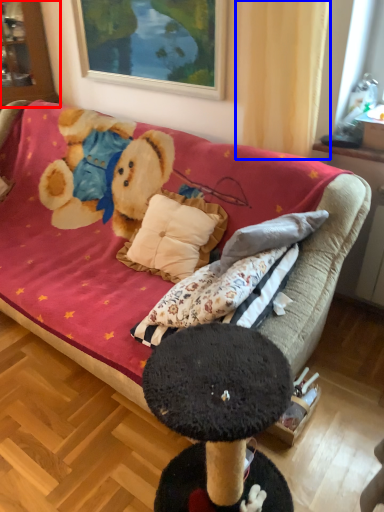
Question: Which point is closer to the camera, cabinetry (highlighted by a red box) or curtain (highlighted by a blue box)?

Choices:
 (A) cabinetry
 (B) curtain

Answer: (B)